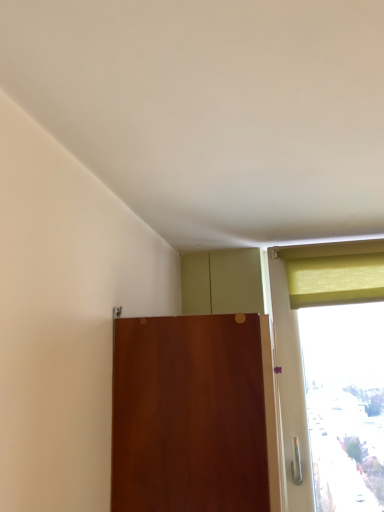
What do you see at coordinates (335, 279) in the screenshot? I see `matte yellow curtain at upper right` at bounding box center [335, 279].

Find the location of a particular element. matte yellow curtain at upper right is located at coordinates (335, 279).

Image resolution: width=384 pixels, height=512 pixels. What are the coordinates of `matte wood door at center` in the screenshot? It's located at (189, 415).

The width and height of the screenshot is (384, 512). What do you see at coordinates (189, 415) in the screenshot? I see `matte wood door at center` at bounding box center [189, 415].

Locate an element on the screen. matte yellow curtain at upper right is located at coordinates (335, 279).

Considering the relative positions of matte wood door at center and matte yellow curtain at upper right in the image provided, is matte wood door at center to the left or to the right of matte yellow curtain at upper right?

matte wood door at center is to the left of matte yellow curtain at upper right.

Does matte wood door at center come in front of matte yellow curtain at upper right?

Yes, matte wood door at center is closer to the viewer.

Is point (201, 410) closer to camera compared to point (307, 292)?

Yes, point (201, 410) is in front of point (307, 292).

From the image's perspective, which object appears higher, matte wood door at center or matte yellow curtain at upper right?

From the image's view, matte yellow curtain at upper right is above.

From a real-world perspective, between matte wood door at center and matte yellow curtain at upper right, who is vertically lower?

From a 3D spatial view, matte wood door at center is below.

Can you confirm if matte wood door at center is wider than matte yellow curtain at upper right?

Yes.

Considering the sizes of objects matte wood door at center and matte yellow curtain at upper right in the image provided, who is shorter, matte wood door at center or matte yellow curtain at upper right?

matte yellow curtain at upper right.

In the scene shown: Does matte wood door at center have a larger size compared to matte yellow curtain at upper right?

Yes, matte wood door at center is bigger than matte yellow curtain at upper right.

Choose the correct answer: Is matte wood door at center inside matte yellow curtain at upper right or outside it?

matte wood door at center is located beyond the bounds of matte yellow curtain at upper right.

Is matte wood door at center not near matte yellow curtain at upper right?

Actually, matte wood door at center and matte yellow curtain at upper right are a little close together.

Is matte wood door at center turned away from matte yellow curtain at upper right?

matte wood door at center does not have its back to matte yellow curtain at upper right.

Can you tell me how much matte wood door at center and matte yellow curtain at upper right differ in facing direction?

The angle between the facing direction of matte wood door at center and the facing direction of matte yellow curtain at upper right is 90.1 degrees.

Consider the image. Measure the distance from matte wood door at center to matte yellow curtain at upper right.

62.07 centimeters.

The width and height of the screenshot is (384, 512). I want to click on curtain above the matte wood door at center (from the image's perspective), so click(335, 279).

Does matte yellow curtain at upper right appear on the left side of matte wood door at center?

No.

Which object is further away from the camera, matte yellow curtain at upper right or matte wood door at center?

matte yellow curtain at upper right is more distant.

Which is less distant, (368, 255) or (239, 420)?

Point (368, 255) is farther from the camera than point (239, 420).

From the image's perspective, is matte yellow curtain at upper right beneath matte wood door at center?

Actually, matte yellow curtain at upper right appears above matte wood door at center in the image.

From a real-world perspective, is matte yellow curtain at upper right positioned above or below matte wood door at center?

matte yellow curtain at upper right is situated higher than matte wood door at center in the real world.

Considering the sizes of objects matte yellow curtain at upper right and matte wood door at center in the image provided, who is wider, matte yellow curtain at upper right or matte wood door at center?

matte wood door at center is wider.

Considering the sizes of objects matte yellow curtain at upper right and matte wood door at center in the image provided, who is taller, matte yellow curtain at upper right or matte wood door at center?

Standing taller between the two is matte wood door at center.

Who is smaller, matte yellow curtain at upper right or matte wood door at center?

matte yellow curtain at upper right.

Is matte yellow curtain at upper right inside or outside of matte wood door at center?

matte yellow curtain at upper right cannot be found inside matte wood door at center.

Consider the image. Can you see matte yellow curtain at upper right touching matte wood door at center?

matte yellow curtain at upper right is not next to matte wood door at center, and they're not touching.

Is matte yellow curtain at upper right oriented towards matte wood door at center?

No.

Can you tell me how much matte yellow curtain at upper right and matte wood door at center differ in facing direction?

matte yellow curtain at upper right and matte wood door at center are facing 90.1 degrees away from each other.

I want to click on door that appears below the matte yellow curtain at upper right (from a real-world perspective), so click(189, 415).

Locate an element on the screen. This screenshot has height=512, width=384. door to the left of matte yellow curtain at upper right is located at coordinates pyautogui.click(x=189, y=415).

The image size is (384, 512). In the image, there is a matte wood door at center. What are the coordinates of `curtain above it (from the image's perspective)` in the screenshot? It's located at (335, 279).